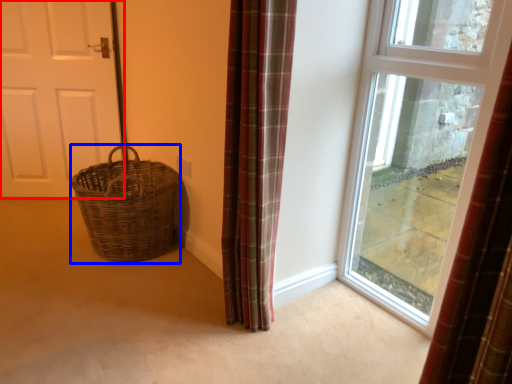
Question: Which of the following is the farthest to the observer, door (highlighted by a red box) or basket (highlighted by a blue box)?

Choices:
 (A) door
 (B) basket

Answer: (A)